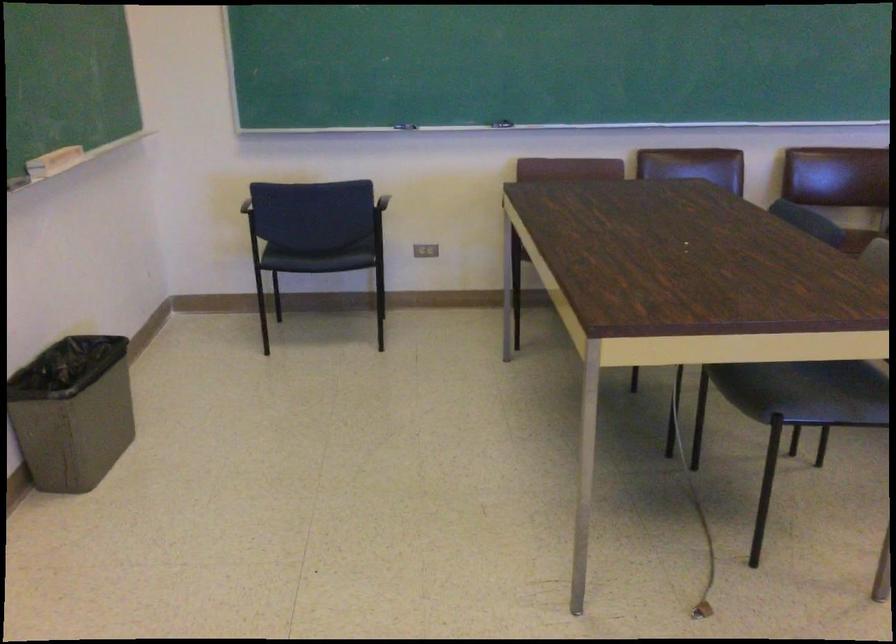
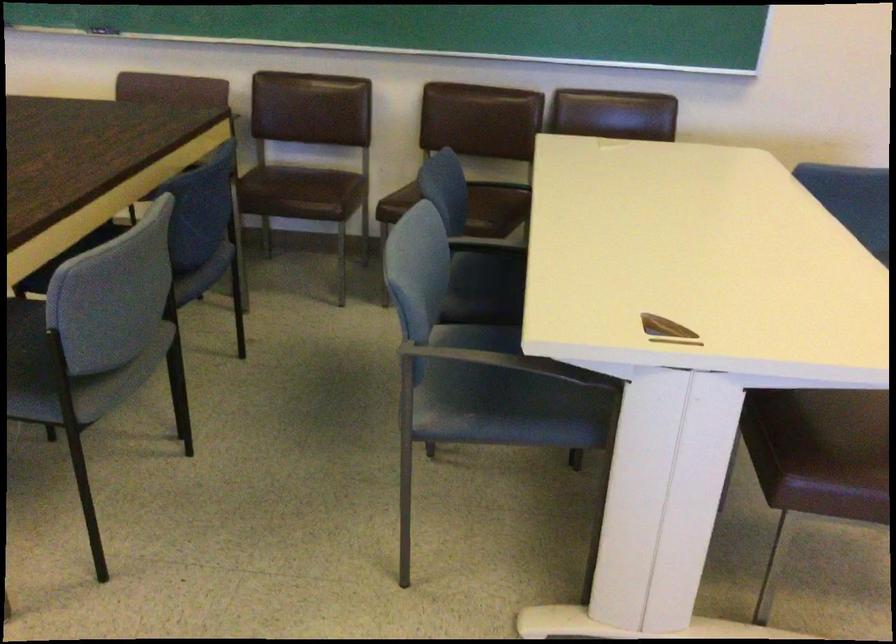
Question: What movement of the cameraman would produce the second image?

Choices:
 (A) Left
 (B) Right
 (C) Forward
 (D) Backward

Answer: (B)